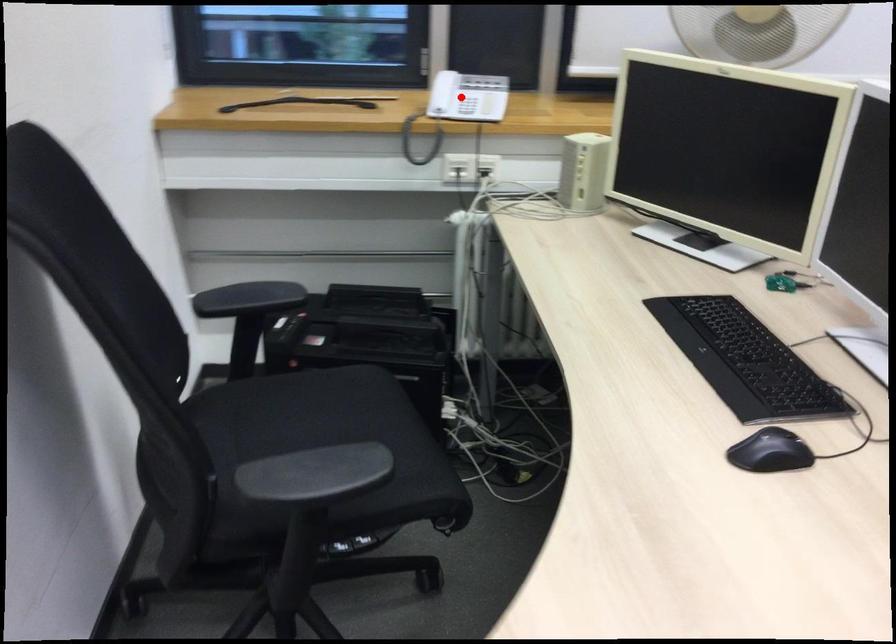
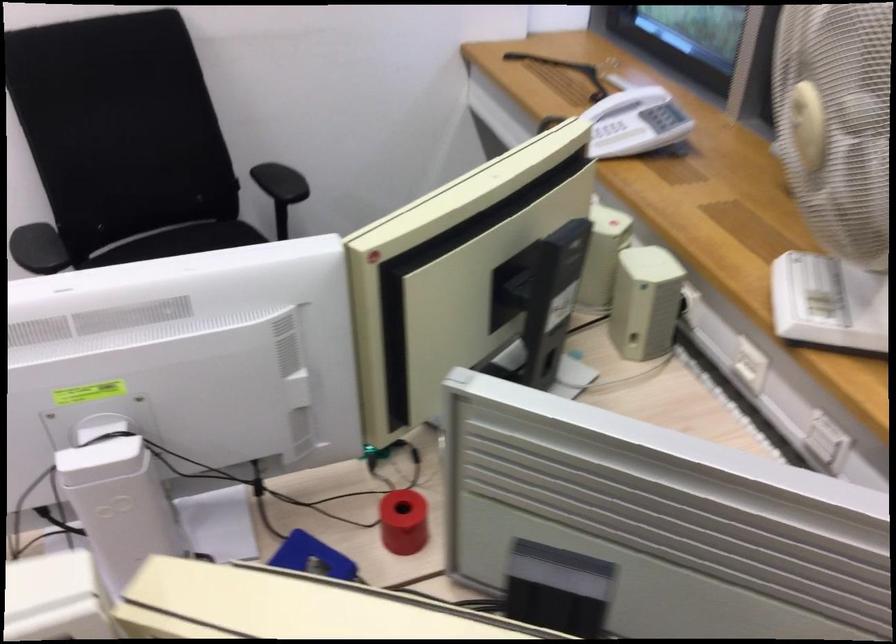
Question: I am providing you with two images of the same scene from different viewpoints. A red point is marked on the first image. Is the red point's position out of view in image 2?

Choices:
 (A) Yes
 (B) No

Answer: (B)